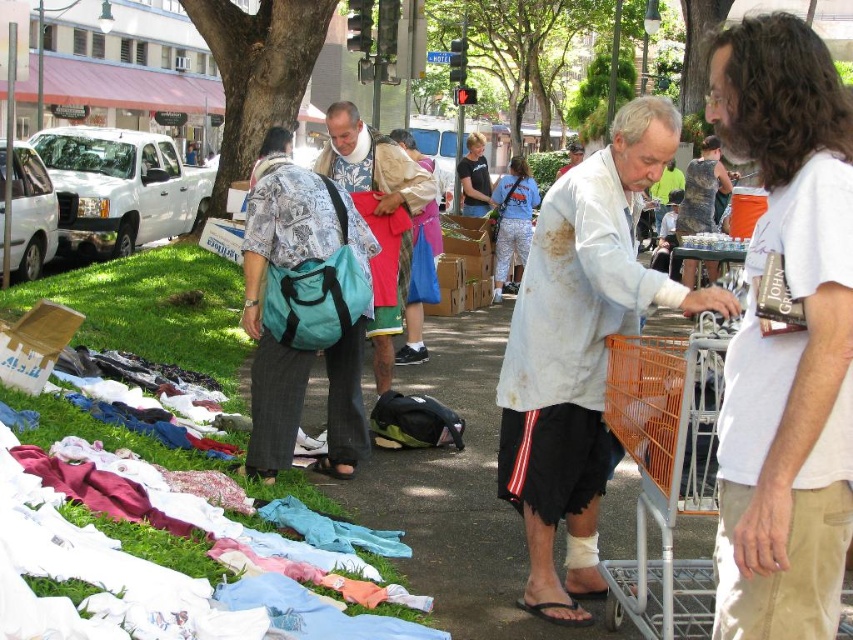
You are standing at the flea market and want to take a photo of both the point at coordinates point (614,577) and point (497,252). Which point should you focus on to ensure both are in clear view?

You should focus on point (614,577) because it is closer to the camera than point (497,252), so focusing on it will keep both in focus.

You are standing at the entrance of the flea market and want to find the matte khaki shirt at center. According to the scene description, where should you look relative to the shopping cart?

The matte khaki shirt at center is located at point (372, 164), which is closer to the entrance than the shopping cart. Therefore, you should look towards the entrance side of the shopping cart to find it.